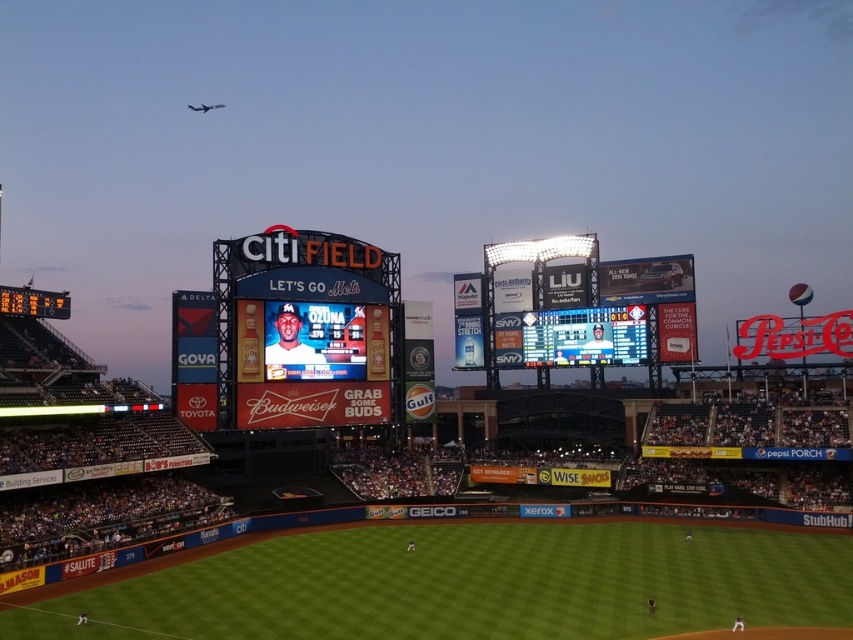
Question: Which object appears closest to the camera in this image?

Choices:
 (A) orange digital scoreboard at left
 (B) matte digital display at center

Answer: (A)

Question: Which point appears farthest from the camera in this image?

Choices:
 (A) (577, 348)
 (B) (289, 259)

Answer: (A)

Question: Considering the relative positions of matte digital display at center and matte digital scoreboard at center in the image provided, where is matte digital display at center located with respect to matte digital scoreboard at center?

Choices:
 (A) left
 (B) right

Answer: (A)

Question: Is matte digital scoreboard at center below orange digital scoreboard at left?

Choices:
 (A) yes
 (B) no

Answer: (A)

Question: Among these points, which one is farthest from the camera?

Choices:
 (A) (10, 307)
 (B) (592, 360)
 (C) (317, 280)

Answer: (B)

Question: Can you confirm if matte digital display at center is positioned above orange digital scoreboard at left?

Choices:
 (A) yes
 (B) no

Answer: (B)